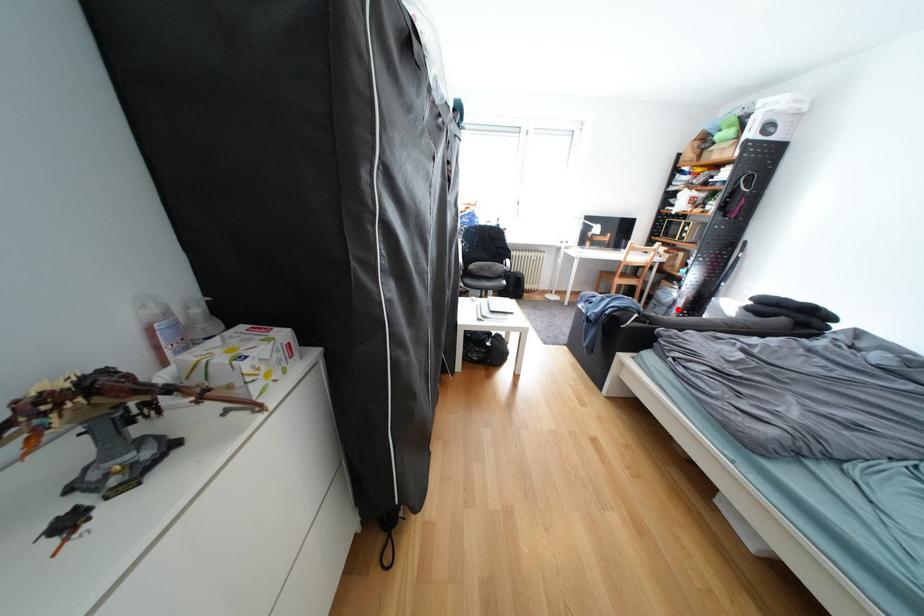
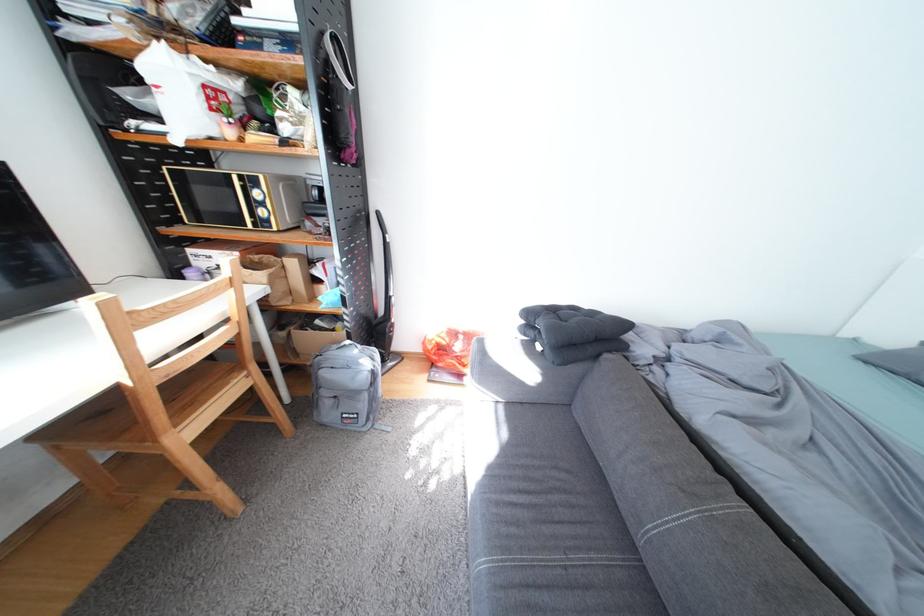
Question: I am providing you with two images of the same scene from different viewpoints. Given a red point in image1, look at the same physical point in image2. Is it:

Choices:
 (A) Closer to the viewpoint
 (B) Farther from the viewpoint

Answer: (A)